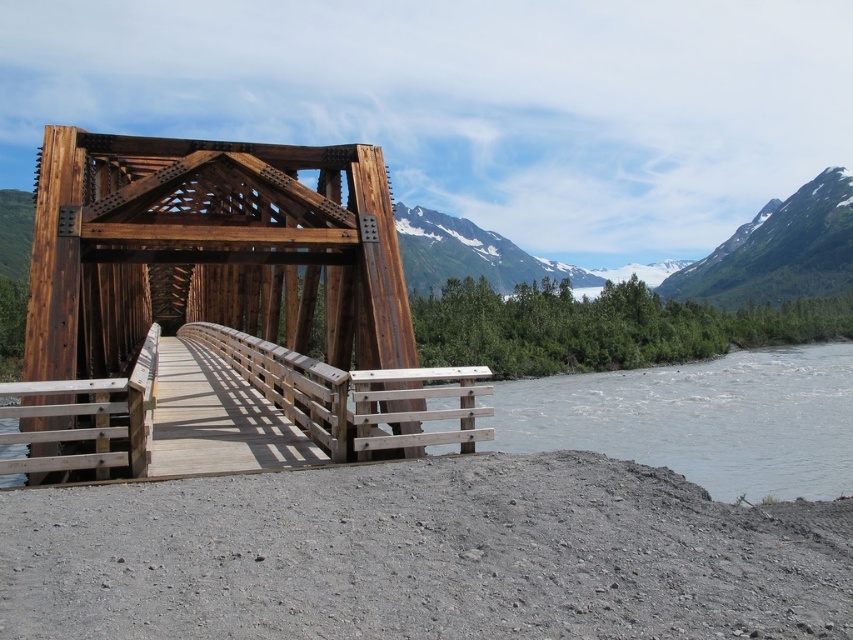
You are standing at the starting point of the bridge and want to reach the other side. Given the coordinates of the matte brown wooden bridge at center, can you estimate how far you need to walk to reach the midpoint of the bridge?

The coordinates of the matte brown wooden bridge at center are at point (219, 300), so the midpoint would be halfway along its length. However, without knowing the total length of the bridge, it is impossible to provide an exact distance in meters or feet. The question cannot be answered with the given information.

In the scene shown: You are standing on the matte brown wooden bridge at center and want to take a photo of the green forested mountain at upper right. In which direction should you point your camera to capture the mountain in the frame?

You should point your camera to the right to capture the green forested mountain at upper right in the frame because the matte brown wooden bridge at center is to the left of it.